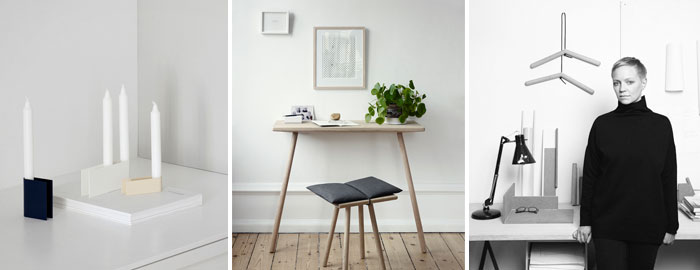
You are a GUI agent. You are given a task and a screenshot of the screen. Output one action in this format:
    pyautogui.click(x=<x>, y=<y>)
    Task: Click on the light source
    
    Given the screenshot: What is the action you would take?
    click(680, 73), click(561, 69), click(511, 150), click(26, 130), click(99, 124), click(120, 130), click(155, 147)